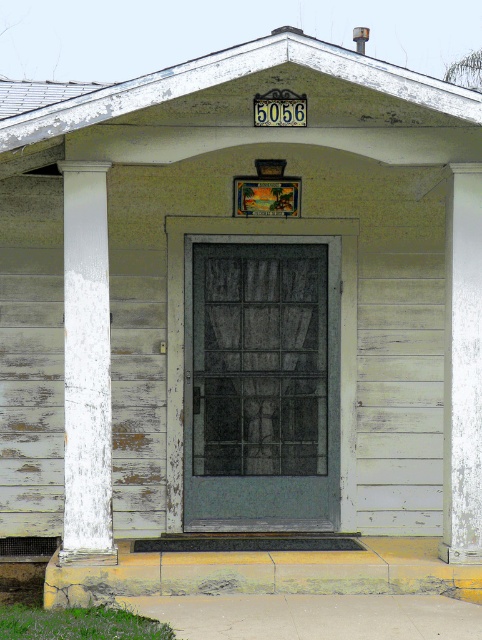
Is white painted wood column at left to the left of white painted wood at center from the viewer's perspective?

Correct, you'll find white painted wood column at left to the left of white painted wood at center.

Measure the distance between white painted wood column at left and camera.

white painted wood column at left is 8.22 meters from camera.

At what (x,y) coordinates should I click in order to perform the action: click on white painted wood column at left. Please return your answer as a coordinate pair (x, y). Looking at the image, I should click on pyautogui.click(x=86, y=368).